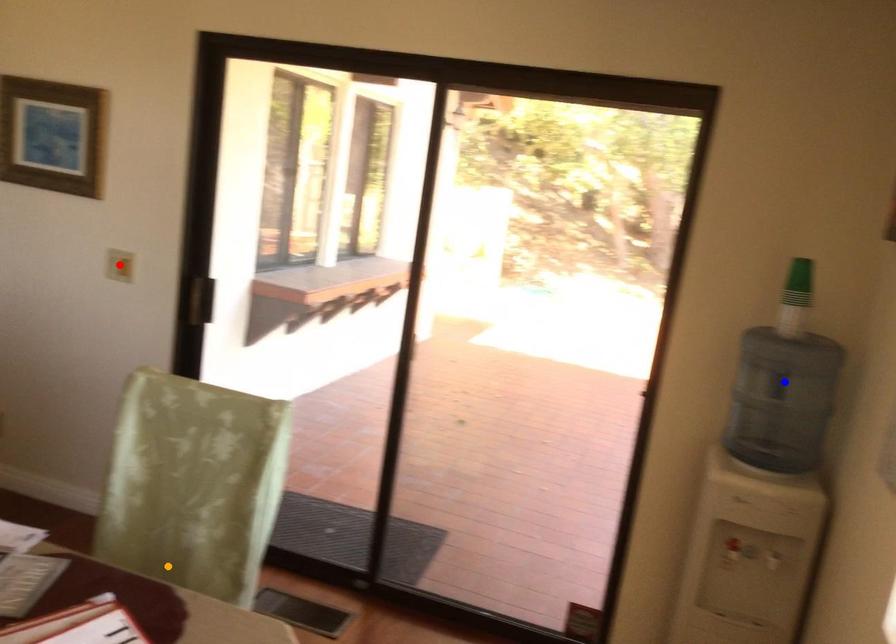
Order these from farthest to nearest:
1. red point
2. blue point
3. orange point

red point → blue point → orange point